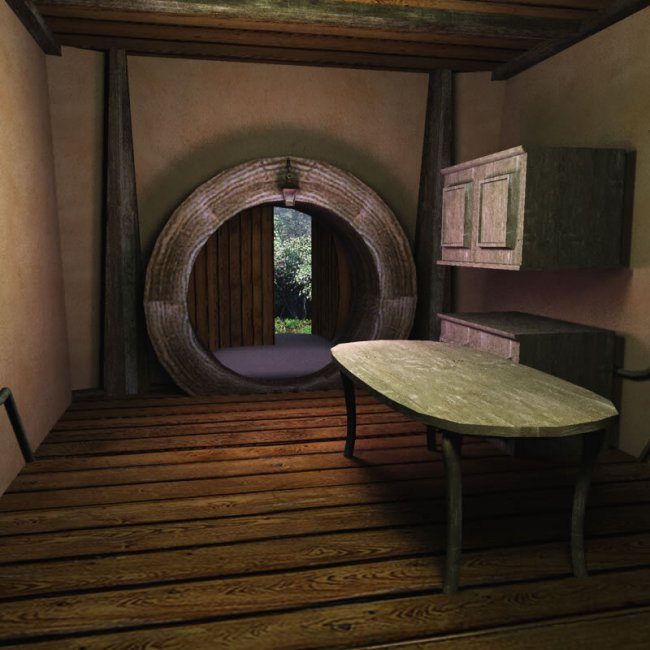
The height and width of the screenshot is (650, 650). In order to click on lamp in this screenshot , I will do `click(289, 195)`.